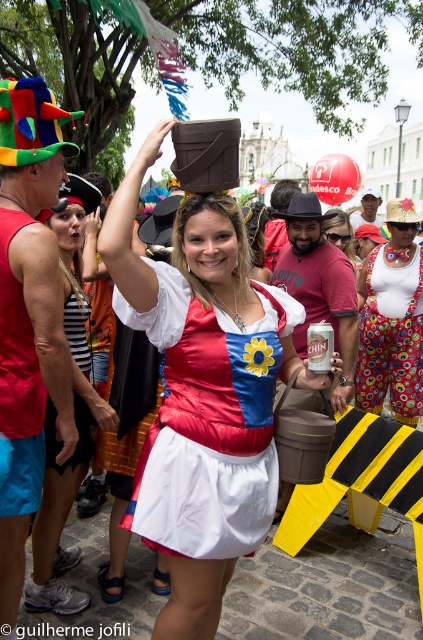
From the picture: You are at the coordinates point 0.5, 0.5. You want to move to the matte white dress at center. In which direction should you move?

You should move towards the coordinates point (74, 417) to reach the matte white dress at center.